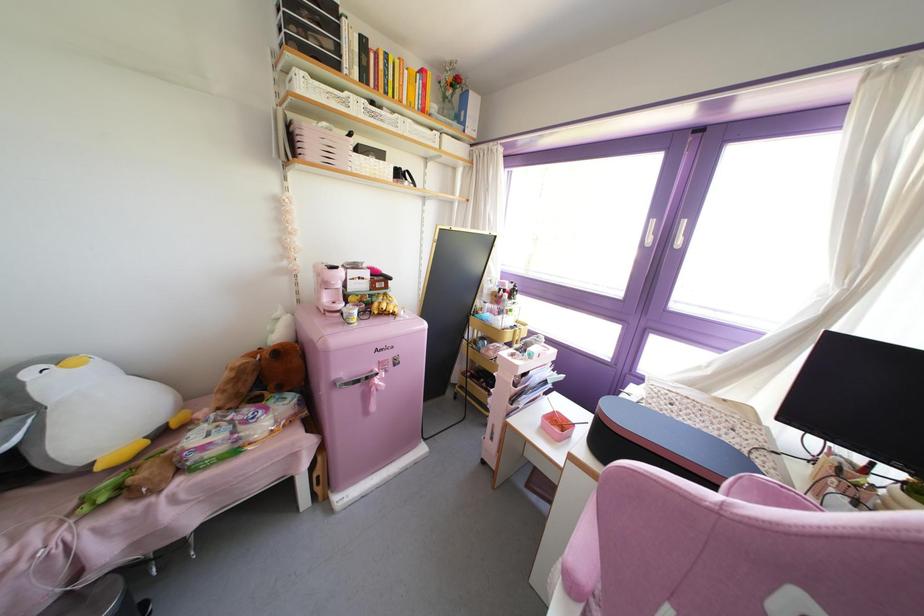
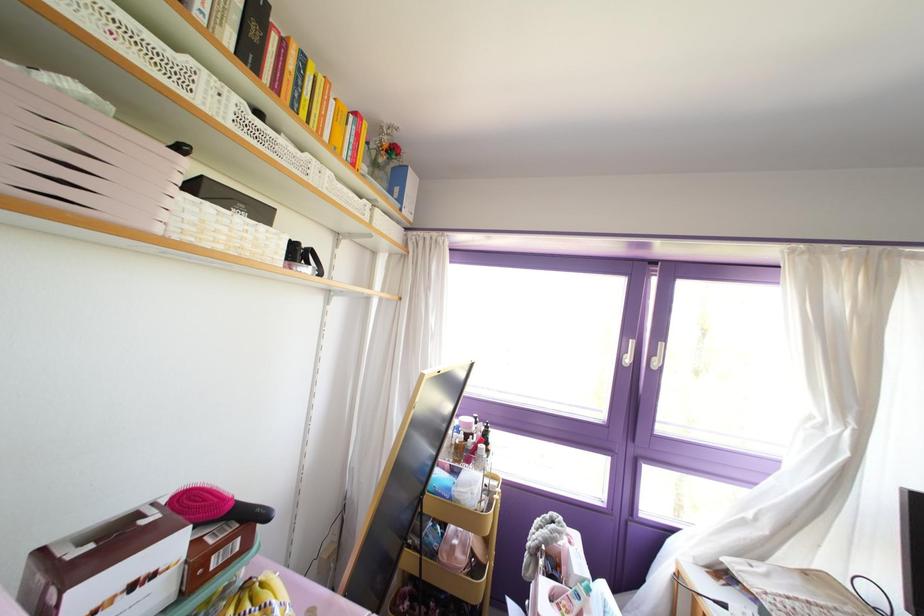
In the second image, find the point that corresponds to point (444, 98) in the first image.

(372, 163)